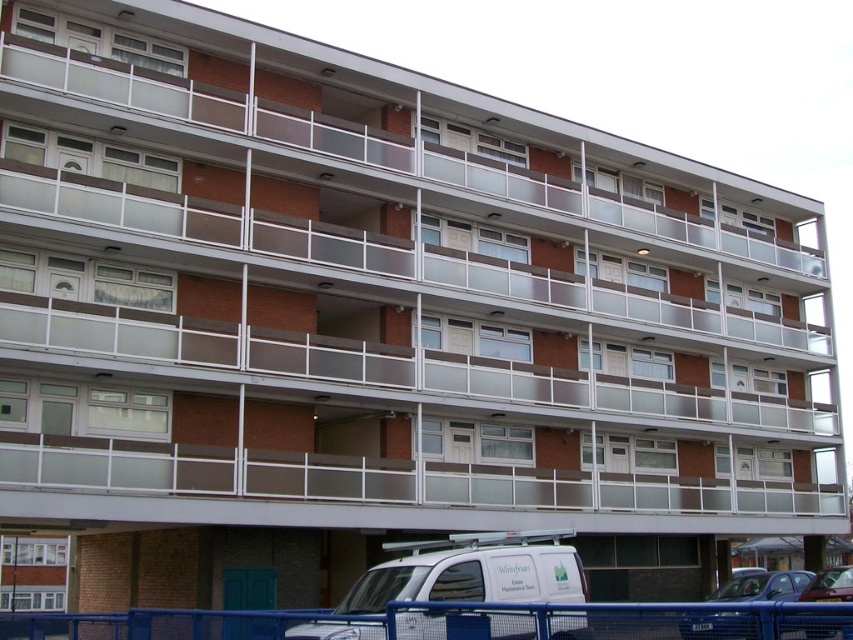
Can you confirm if white glass balcony at upper center is taller than metallic silver car at lower right?

In fact, white glass balcony at upper center may be shorter than metallic silver car at lower right.

Can you confirm if white glass balcony at upper center is shorter than metallic silver car at lower right?

Correct, white glass balcony at upper center is not as tall as metallic silver car at lower right.

The height and width of the screenshot is (640, 853). What do you see at coordinates (364, 147) in the screenshot?
I see `white glass balcony at upper center` at bounding box center [364, 147].

Identify the location of white glass balcony at upper center. This screenshot has width=853, height=640. (364, 147).

Who is taller, white glass balcony at upper center or white matte van at lower center?

white glass balcony at upper center is taller.

Identify the location of white glass balcony at upper center. (364, 147).

Locate an element on the screen. white glass balcony at upper center is located at coordinates (364, 147).

Does white matte van at lower center have a lesser height compared to metallic silver car at lower right?

Correct, white matte van at lower center is not as tall as metallic silver car at lower right.

Is white matte van at lower center smaller than metallic silver car at lower right?

Yes, white matte van at lower center is smaller than metallic silver car at lower right.

This screenshot has width=853, height=640. In order to click on white matte van at lower center in this screenshot , I will do `click(473, 572)`.

The height and width of the screenshot is (640, 853). What are the coordinates of `white matte van at lower center` in the screenshot? It's located at (473, 572).